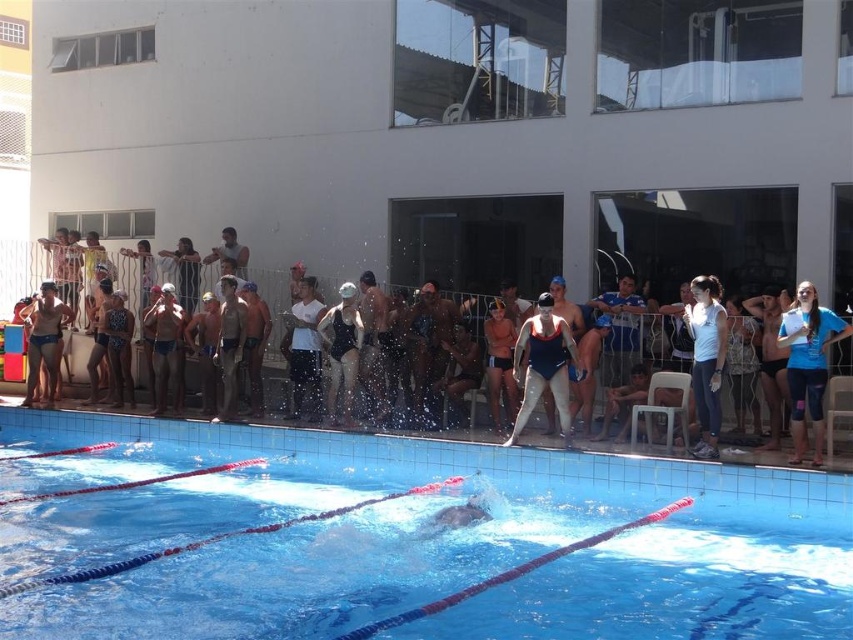
You are a lifeguard on duty at the pool. You need to reach the swimmer wearing the blue fabric swimsuit at upper right as quickly as possible. The solid blue swimsuit at center is in your path. Can you safely navigate around them without getting too close? The minimum safe distance required is 1.5 meters.

The distance between the solid blue swimsuit at center and the blue fabric swimsuit at upper right is 2.36 meters. Since the minimum safe distance required is 1.5 meters, you can safely navigate around the solid blue swimsuit at center while maintaining the required distance of 1.5 meters or more.

You are standing at the edge of the pool and want to throw a ball to a friend. There are two points marked in the pool where you can aim. The first point is at coordinate point (821, 400) and the second is at point (538, 332). Which point is closer to you?

Point (821, 400) is closer to the viewer than point (538, 332), so you should aim for that point.

You are a photographer at the poolside and want to capture both the solid blue swimsuit at center and the blue fabric swimsuit at upper right in a single shot. Which swimmer should you focus on first to ensure both are in frame?

You should focus on the solid blue swimsuit at center first because it is larger and will be easier to frame, ensuring the smaller blue fabric swimsuit at upper right also fits into the shot.